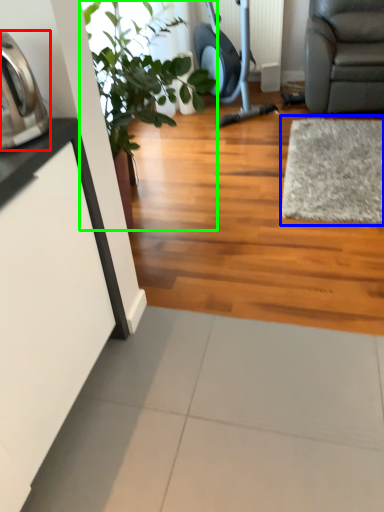
Question: Based on their relative distances, which object is nearer to appliance (highlighted by a red box)? Choose from mat (highlighted by a blue box) and houseplant (highlighted by a green box).

Choices:
 (A) mat
 (B) houseplant

Answer: (B)